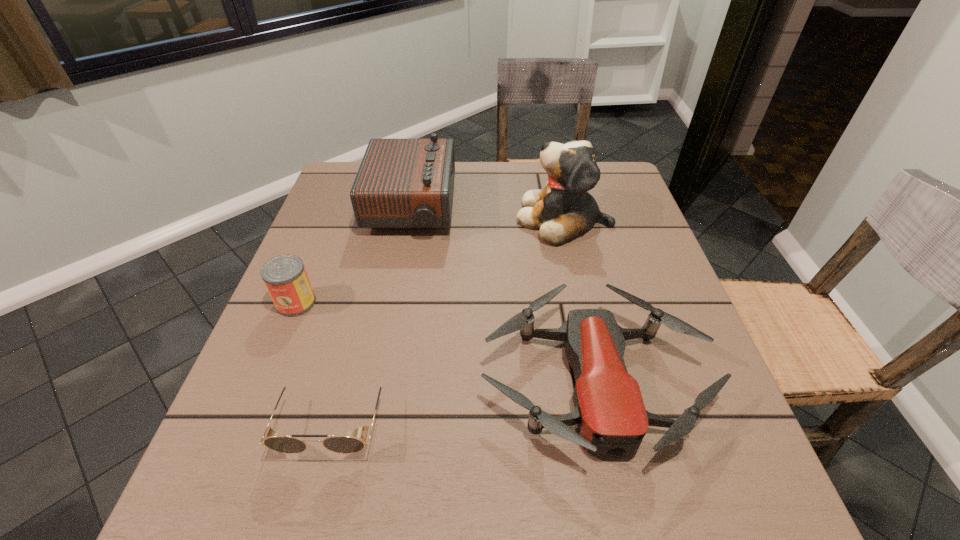
Where is `the tallest object`? the tallest object is located at coordinates (564, 209).

This screenshot has height=540, width=960. What are the coordinates of `the fourth shortest object` in the screenshot? It's located at (401, 183).

In order to click on the leftmost object in this screenshot , I will do `click(285, 277)`.

The width and height of the screenshot is (960, 540). In order to click on drone in this screenshot , I will do `click(611, 417)`.

Locate an element on the screen. This screenshot has height=540, width=960. sunglasses is located at coordinates (340, 444).

The width and height of the screenshot is (960, 540). Find the location of `vacant space located at the face of the tallest object`. vacant space located at the face of the tallest object is located at coordinates (476, 219).

At what (x,y) coordinates should I click in order to perform the action: click on free space located 0.200m at the face of the tallest object. Please return your answer as a coordinate pair (x, y). The height and width of the screenshot is (540, 960). Looking at the image, I should click on (437, 219).

Locate an element on the screen. The image size is (960, 540). vacant space located at the face of the tallest object is located at coordinates (378, 219).

At what (x,y) coordinates should I click in order to perform the action: click on free space located on the tuning display of the radio receiver. Please return your answer as a coordinate pair (x, y). This screenshot has height=540, width=960. Looking at the image, I should click on pos(568,208).

You are a GUI agent. You are given a task and a screenshot of the screen. Output one action in this format:
    pyautogui.click(x=<x>, y=<y>)
    Task: Click on the blank space located 0.270m on the front of the leftmost object
    
    Given the screenshot: What is the action you would take?
    pyautogui.click(x=237, y=448)